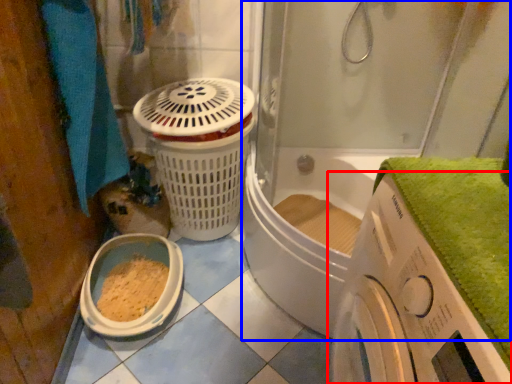
Question: Among these objects, which one is farthest to the camera, washing machine (highlighted by a red box) or shower door (highlighted by a blue box)?

Choices:
 (A) washing machine
 (B) shower door

Answer: (B)